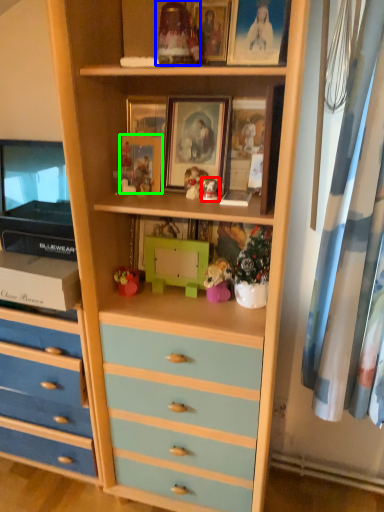
Question: Estimate the real-world distances between objects in this image. Which object is closer to toy (highlighted by a red box), toy (highlighted by a blue box) or picture frame (highlighted by a green box)?

Choices:
 (A) toy
 (B) picture frame

Answer: (B)